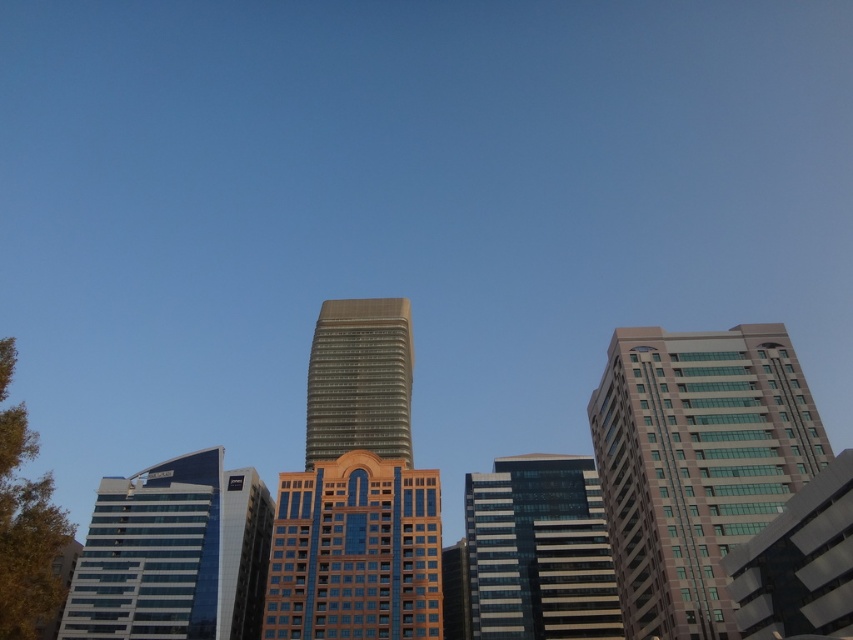
Question: Among these objects, which one is farthest from the camera?

Choices:
 (A) gold glass tower at center
 (B) glassy black building at center
 (C) matte glass building at right

Answer: (A)

Question: Is blue glass building at left to the right of gold glass tower at center from the viewer's perspective?

Choices:
 (A) yes
 (B) no

Answer: (B)

Question: Is blue glass building at left to the right of gold glass tower at center from the viewer's perspective?

Choices:
 (A) yes
 (B) no

Answer: (B)

Question: Which of the following is the closest to the observer?

Choices:
 (A) gold glass building at center
 (B) gold glass tower at center
 (C) glassy black building at center
 (D) matte glass building at right

Answer: (D)

Question: Which point is farther to the camera?

Choices:
 (A) glassy black building at center
 (B) gold glass tower at center
 (C) gold glass building at center

Answer: (B)

Question: Is gold glass building at center to the right of glassy black building at center from the viewer's perspective?

Choices:
 (A) no
 (B) yes

Answer: (A)